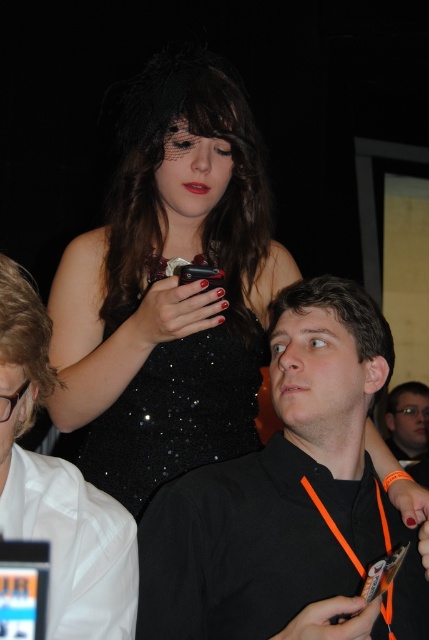
Measure the distance between black sequined dress at upper center and white glossy shirt at upper left.

black sequined dress at upper center and white glossy shirt at upper left are 18.27 inches apart from each other.

Who is lower down, black sequined dress at upper center or white glossy shirt at upper left?

white glossy shirt at upper left is lower down.

What do you see at coordinates (169, 288) in the screenshot? I see `black sequined dress at upper center` at bounding box center [169, 288].

The image size is (429, 640). Find the location of `black sequined dress at upper center`. black sequined dress at upper center is located at coordinates pyautogui.click(x=169, y=288).

Consider the image. Between black matte shirt at center and black sequined dress at center, which one is positioned lower?

Positioned lower is black matte shirt at center.

Is the position of black matte shirt at center less distant than that of black sequined dress at center?

Yes, black matte shirt at center is in front of black sequined dress at center.

The height and width of the screenshot is (640, 429). I want to click on black matte shirt at center, so click(x=277, y=484).

From the picture: Between black sequined dress at upper center and black sequined dress at center, which one is positioned lower?

black sequined dress at center is below.

Does black sequined dress at upper center have a lesser width compared to black sequined dress at center?

Incorrect, black sequined dress at upper center's width is not less than black sequined dress at center's.

Is point (232, 164) positioned behind point (204, 388)?

That is True.

Identify the location of black sequined dress at upper center. (169, 288).